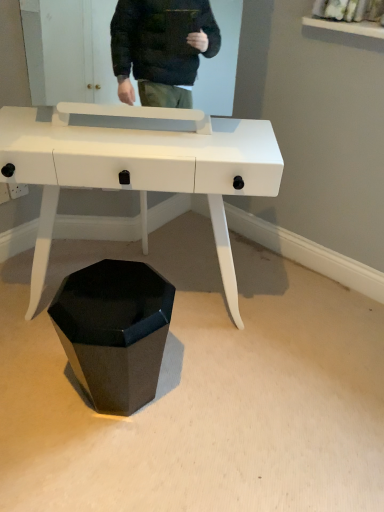
The height and width of the screenshot is (512, 384). What are the coordinates of `glossy black hexagonal at lower center` in the screenshot? It's located at (114, 331).

Describe the element at coordinates (114, 331) in the screenshot. The width and height of the screenshot is (384, 512). I see `glossy black hexagonal at lower center` at that location.

The image size is (384, 512). Describe the element at coordinates (139, 172) in the screenshot. I see `white glossy desk at center` at that location.

The height and width of the screenshot is (512, 384). Identify the location of white glossy desk at center. (139, 172).

Where is `glossy black hexagonal at lower center`? The height and width of the screenshot is (512, 384). glossy black hexagonal at lower center is located at coordinates (114, 331).

Can you confirm if white glossy desk at center is positioned to the right of glossy black hexagonal at lower center?

Yes, white glossy desk at center is to the right of glossy black hexagonal at lower center.

Considering their positions, is white glossy desk at center located in front of or behind glossy black hexagonal at lower center?

white glossy desk at center is positioned closer to the viewer than glossy black hexagonal at lower center.

Which is closer to the camera, (55, 135) or (118, 349)?

The point (55, 135) is in front.

From the image's perspective, who appears lower, white glossy desk at center or glossy black hexagonal at lower center?

glossy black hexagonal at lower center, from the image's perspective.

From a real-world perspective, which object stands above the other?

In real-world perspective, white glossy desk at center is above.

Based on the photo, considering the sizes of objects white glossy desk at center and glossy black hexagonal at lower center in the image provided, who is wider, white glossy desk at center or glossy black hexagonal at lower center?

white glossy desk at center is wider.

In the scene shown: Is white glossy desk at center shorter than glossy black hexagonal at lower center?

No, white glossy desk at center is not shorter than glossy black hexagonal at lower center.

Who is bigger, white glossy desk at center or glossy black hexagonal at lower center?

Bigger between the two is white glossy desk at center.

Would you say white glossy desk at center is inside or outside glossy black hexagonal at lower center?

white glossy desk at center is not enclosed by glossy black hexagonal at lower center.

Is white glossy desk at center far from glossy black hexagonal at lower center?

No, white glossy desk at center is not far from glossy black hexagonal at lower center.

Is white glossy desk at center oriented away from glossy black hexagonal at lower center?

That's not correct — white glossy desk at center is not looking away from glossy black hexagonal at lower center.

In order to click on desk above the glossy black hexagonal at lower center (from a real-world perspective) in this screenshot , I will do `click(139, 172)`.

Which is more to the left, glossy black hexagonal at lower center or white glossy desk at center?

glossy black hexagonal at lower center.

Which object is more forward, glossy black hexagonal at lower center or white glossy desk at center?

Positioned in front is white glossy desk at center.

Considering the positions of point (155, 308) and point (180, 190), is point (155, 308) closer or farther from the camera than point (180, 190)?

Point (155, 308).

From the image's perspective, which one is positioned lower, glossy black hexagonal at lower center or white glossy desk at center?

glossy black hexagonal at lower center, from the image's perspective.

From a real-world perspective, is glossy black hexagonal at lower center physically above white glossy desk at center?

No, from a real-world perspective, glossy black hexagonal at lower center is not above white glossy desk at center.

Looking at their sizes, would you say glossy black hexagonal at lower center is wider or thinner than white glossy desk at center?

Considering their sizes, glossy black hexagonal at lower center looks slimmer than white glossy desk at center.

Does glossy black hexagonal at lower center have a greater height compared to white glossy desk at center?

Incorrect, the height of glossy black hexagonal at lower center is not larger of that of white glossy desk at center.

Is glossy black hexagonal at lower center bigger than white glossy desk at center?

Incorrect, glossy black hexagonal at lower center is not larger than white glossy desk at center.

Would you say glossy black hexagonal at lower center is outside white glossy desk at center?

Yes, glossy black hexagonal at lower center is outside of white glossy desk at center.

Is glossy black hexagonal at lower center placed right next to white glossy desk at center?

No, glossy black hexagonal at lower center is not with white glossy desk at center.

Is glossy black hexagonal at lower center facing towards white glossy desk at center?

Yes, glossy black hexagonal at lower center is oriented towards white glossy desk at center.

How different are the orientations of glossy black hexagonal at lower center and white glossy desk at center in degrees?

173 degrees.

This screenshot has width=384, height=512. I want to click on waste container that appears on the left of white glossy desk at center, so click(114, 331).

Where is `desk positioned vertically above the glossy black hexagonal at lower center (from a real-world perspective)`? The image size is (384, 512). desk positioned vertically above the glossy black hexagonal at lower center (from a real-world perspective) is located at coordinates (139, 172).

The image size is (384, 512). Identify the location of desk on the right side of glossy black hexagonal at lower center. [139, 172].